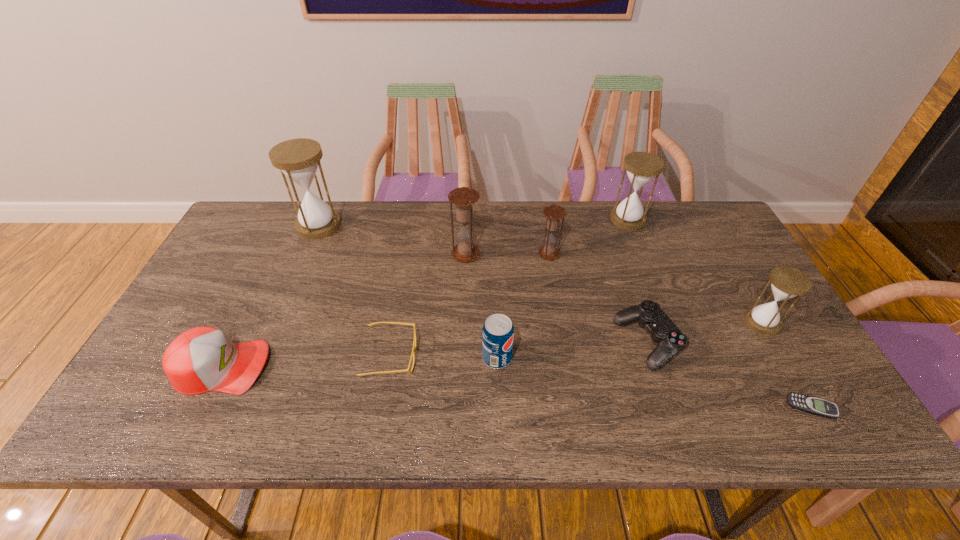
The width and height of the screenshot is (960, 540). I want to click on vacant space located 0.330m on the right of the leftmost hourglass, so click(442, 225).

I want to click on vacant area situated 0.390m on the right of the fourth hourglass from right to left, so click(x=609, y=254).

At what (x,y) coordinates should I click in order to perform the action: click on vacant space situated 0.340m on the front of the second biggest white hourglass. Please return your answer as a coordinate pair (x, y). The height and width of the screenshot is (540, 960). Looking at the image, I should click on tap(662, 310).

At what (x,y) coordinates should I click in order to perform the action: click on vacant space located 0.280m on the right of the third hourglass from left to right. Please return your answer as a coordinate pair (x, y). Looking at the image, I should click on (652, 254).

Identify the location of vacant area situated 0.380m on the back of the rightmost white hourglass. (704, 222).

Find the location of a particular element. Image resolution: width=960 pixels, height=540 pixels. free space located 0.300m on the right of the sixth tallest object is located at coordinates (636, 358).

The width and height of the screenshot is (960, 540). Find the location of `free space located 0.310m on the front-facing side of the red baseball cap`. free space located 0.310m on the front-facing side of the red baseball cap is located at coordinates (397, 367).

Locate an element on the screen. blank area located 0.060m on the back of the eighth tallest object is located at coordinates click(x=634, y=299).

The height and width of the screenshot is (540, 960). Identify the location of free region located in front of the lenses of the beige spectacles. (511, 356).

Where is `vacant region located on the back of the shortest object`? Image resolution: width=960 pixels, height=540 pixels. vacant region located on the back of the shortest object is located at coordinates (789, 368).